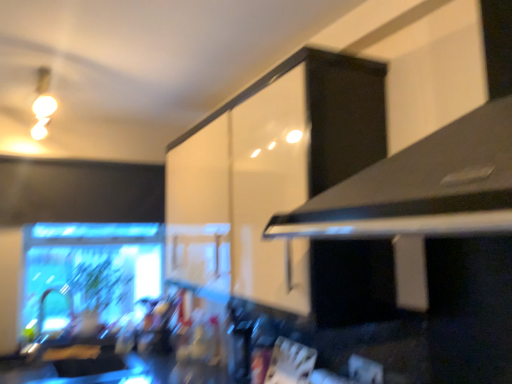
Question: Can you confirm if white glossy cabinet at upper center is wider than matte white bulb at upper left?

Choices:
 (A) no
 (B) yes

Answer: (A)

Question: Can you confirm if white glossy cabinet at upper center is bigger than matte white bulb at upper left?

Choices:
 (A) no
 (B) yes

Answer: (B)

Question: Can you confirm if white glossy cabinet at upper center is positioned to the left of matte white bulb at upper left?

Choices:
 (A) no
 (B) yes

Answer: (A)

Question: Does white glossy cabinet at upper center have a lesser height compared to matte white bulb at upper left?

Choices:
 (A) no
 (B) yes

Answer: (A)

Question: Is white glossy cabinet at upper center far from matte white bulb at upper left?

Choices:
 (A) no
 (B) yes

Answer: (B)

Question: Considering the positions of point (44, 122) and point (455, 228), is point (44, 122) closer or farther from the camera than point (455, 228)?

Choices:
 (A) closer
 (B) farther

Answer: (B)

Question: Based on their positions, is matte white bulb at upper left located to the left or right of black matte exhaust hood at upper right?

Choices:
 (A) left
 (B) right

Answer: (A)

Question: Would you say matte white bulb at upper left is inside or outside black matte exhaust hood at upper right?

Choices:
 (A) outside
 (B) inside

Answer: (A)

Question: Is matte white bulb at upper left taller or shorter than black matte exhaust hood at upper right?

Choices:
 (A) tall
 (B) short

Answer: (B)

Question: In terms of size, does white glossy cabinet at upper center appear bigger or smaller than black matte exhaust hood at upper right?

Choices:
 (A) big
 (B) small

Answer: (A)

Question: Considering their positions, is white glossy cabinet at upper center located in front of or behind black matte exhaust hood at upper right?

Choices:
 (A) front
 (B) behind

Answer: (B)

Question: Considering the positions of white glossy cabinet at upper center and black matte exhaust hood at upper right in the image, is white glossy cabinet at upper center taller or shorter than black matte exhaust hood at upper right?

Choices:
 (A) short
 (B) tall

Answer: (B)

Question: From a real-world perspective, is white glossy cabinet at upper center positioned above or below black matte exhaust hood at upper right?

Choices:
 (A) above
 (B) below

Answer: (B)

Question: Looking at their shapes, would you say matte white bulb at upper left is wider or thinner than white glossy cabinet at upper center?

Choices:
 (A) thin
 (B) wide

Answer: (B)

Question: Is point (38, 82) positioned closer to the camera than point (339, 153)?

Choices:
 (A) closer
 (B) farther

Answer: (B)